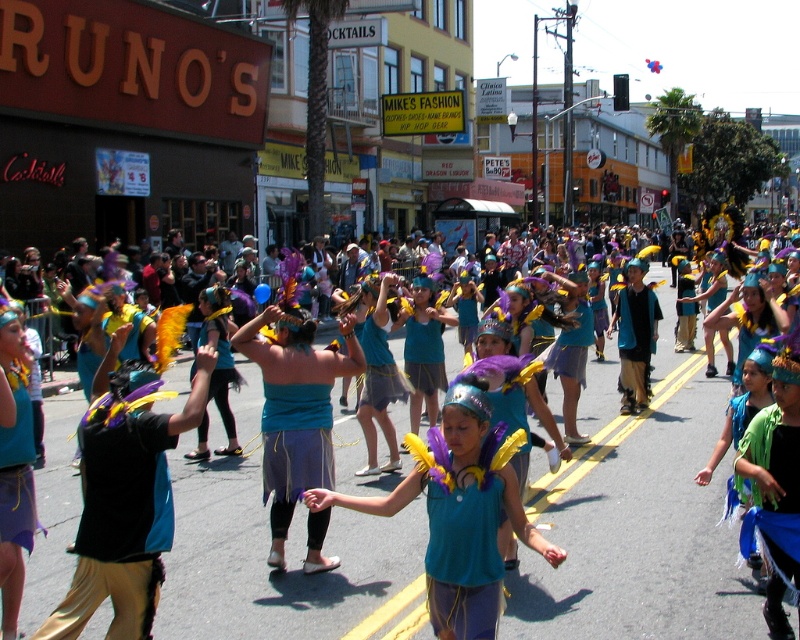
Question: Which object is the closest to the matte blue feathered headdress at center?

Choices:
 (A) matte black shirt at center
 (B) matte teal tank top at center
 (C) teal fabric mask at center
 (D) blue fabric skirt at center

Answer: (D)

Question: Which object appears farthest from the camera in this image?

Choices:
 (A) blue fabric skirt at center
 (B) teal fabric mask at center

Answer: (B)

Question: Does matte teal tank top at center appear on the right side of blue fabric skirt at center?

Choices:
 (A) no
 (B) yes

Answer: (B)

Question: Which point is closer to the camera?

Choices:
 (A) matte teal tank top at center
 (B) teal fabric mask at center
 (C) matte black shirt at center

Answer: (A)

Question: Is matte black shirt at center positioned before matte teal tank top at center?

Choices:
 (A) yes
 (B) no

Answer: (B)

Question: Can you confirm if matte black shirt at center is smaller than blue fabric skirt at center?

Choices:
 (A) yes
 (B) no

Answer: (A)